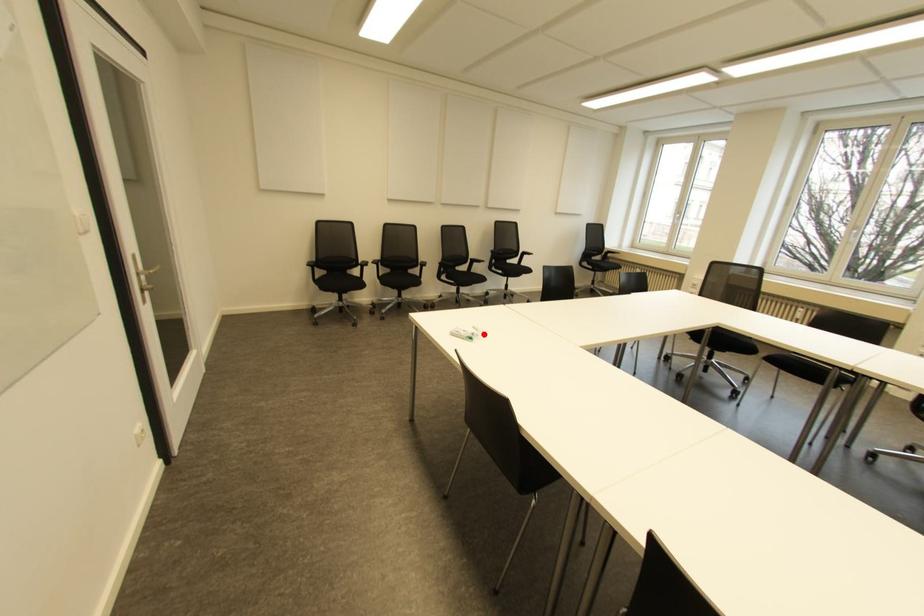
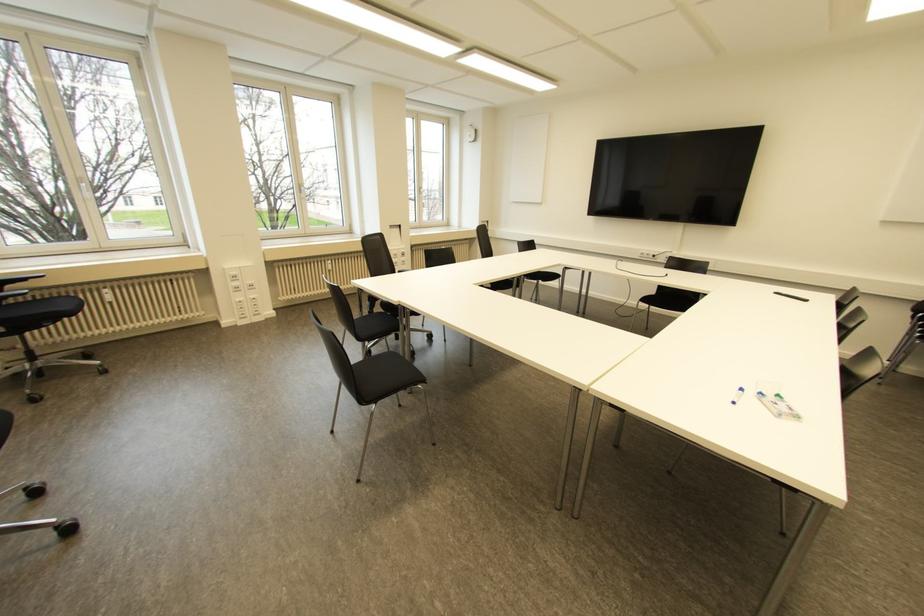
Question: I am providing you with two images of the same scene from different viewpoints. A red point is shown in image1. For the corresponding object point in image2, is it positioned nearer or farther from the camera?

Choices:
 (A) Nearer
 (B) Farther

Answer: (A)